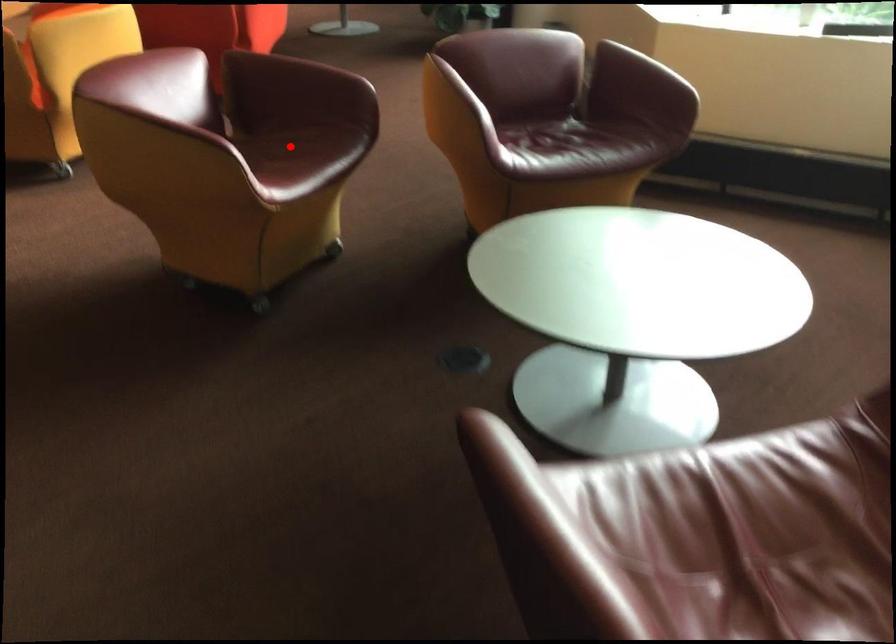
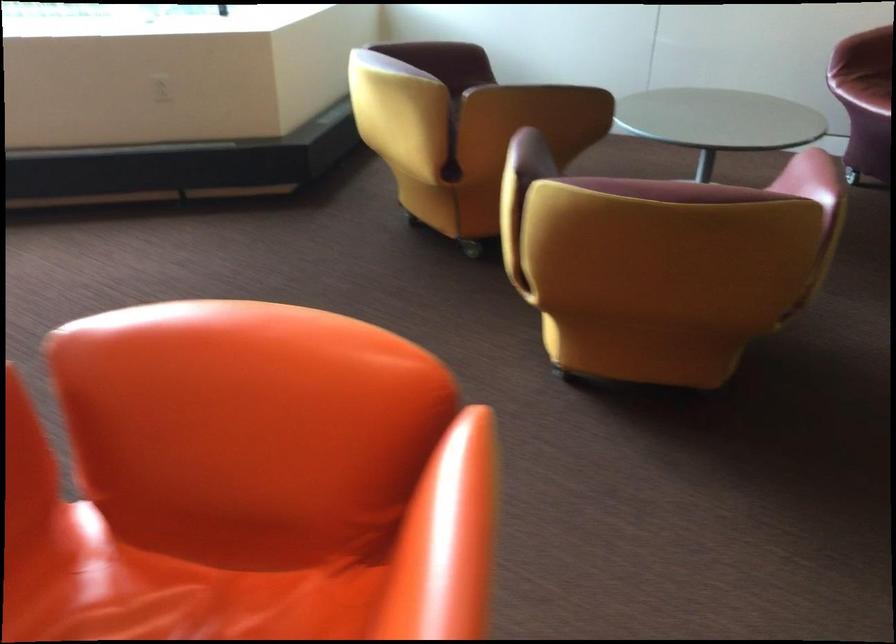
Question: I am providing you with two images of the same scene from different viewpoints. A red point is marked on the first image. Is the red point's position out of view in image 2?

Choices:
 (A) Yes
 (B) No

Answer: (A)